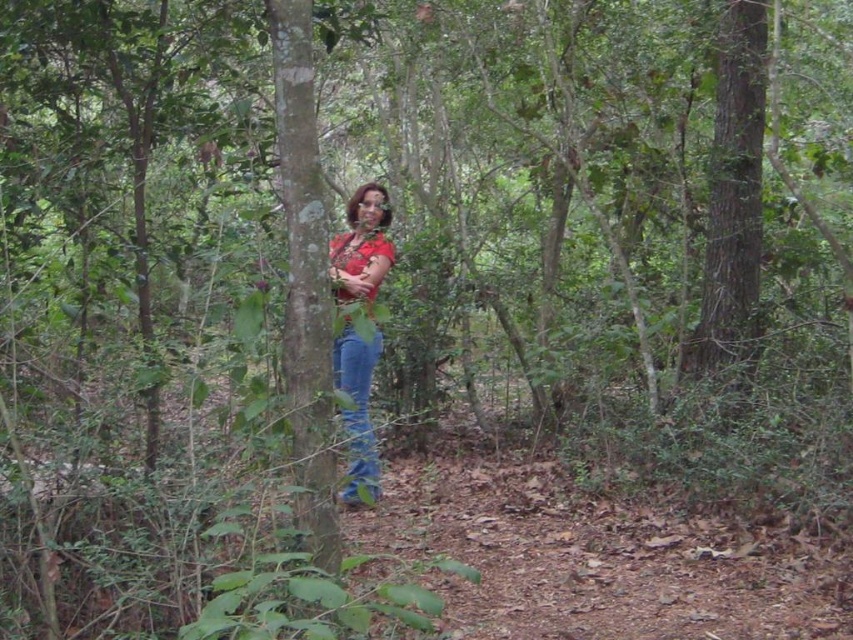
Question: Can you confirm if smooth bark tree trunk at center is wider than matte red shirt at center?

Choices:
 (A) yes
 (B) no

Answer: (B)

Question: Is brown rough tree trunk at right positioned before matte red shirt at center?

Choices:
 (A) yes
 (B) no

Answer: (B)

Question: Which of the following is the farthest from the observer?

Choices:
 (A) smooth bark tree trunk at center
 (B) matte red shirt at center

Answer: (B)

Question: Which point appears farthest from the camera in this image?

Choices:
 (A) (724, 58)
 (B) (300, 428)
 (C) (360, 387)

Answer: (A)

Question: Is brown rough tree trunk at right to the left of matte red shirt at center from the viewer's perspective?

Choices:
 (A) no
 (B) yes

Answer: (A)

Question: Estimate the real-world distances between objects in this image. Which object is farther from the matte red shirt at center?

Choices:
 (A) brown rough tree trunk at right
 (B) smooth bark tree trunk at center

Answer: (A)